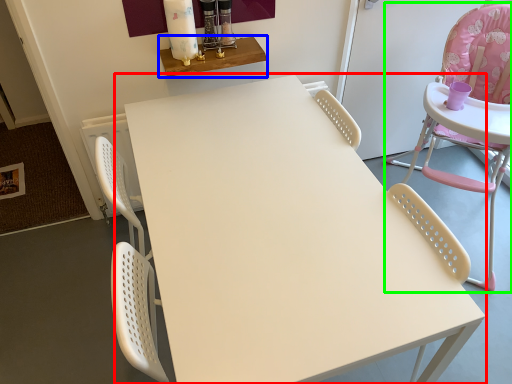
Question: Considering the real-world distances, which object is closest to table (highlighted by a red box)? table (highlighted by a blue box) or chair (highlighted by a green box).

Choices:
 (A) table
 (B) chair

Answer: (A)